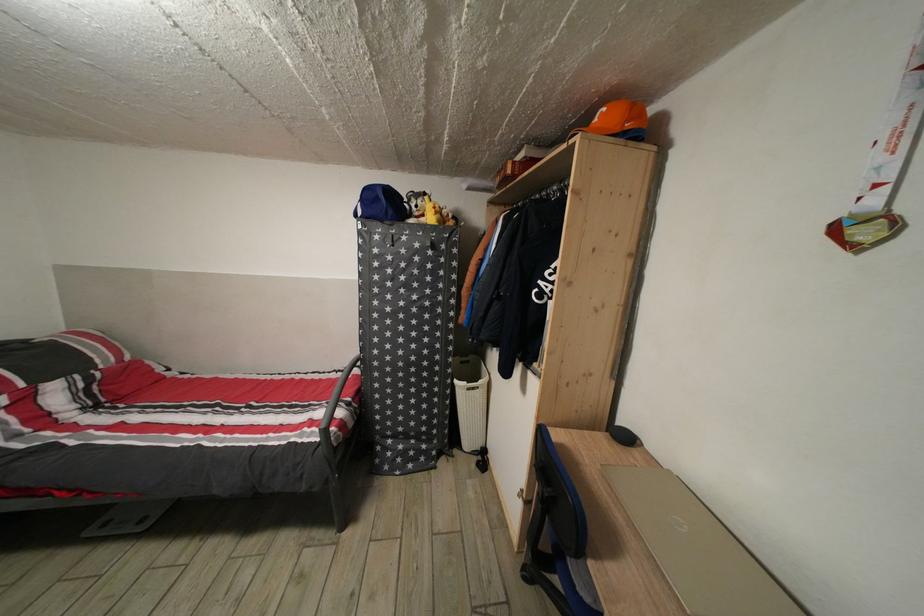
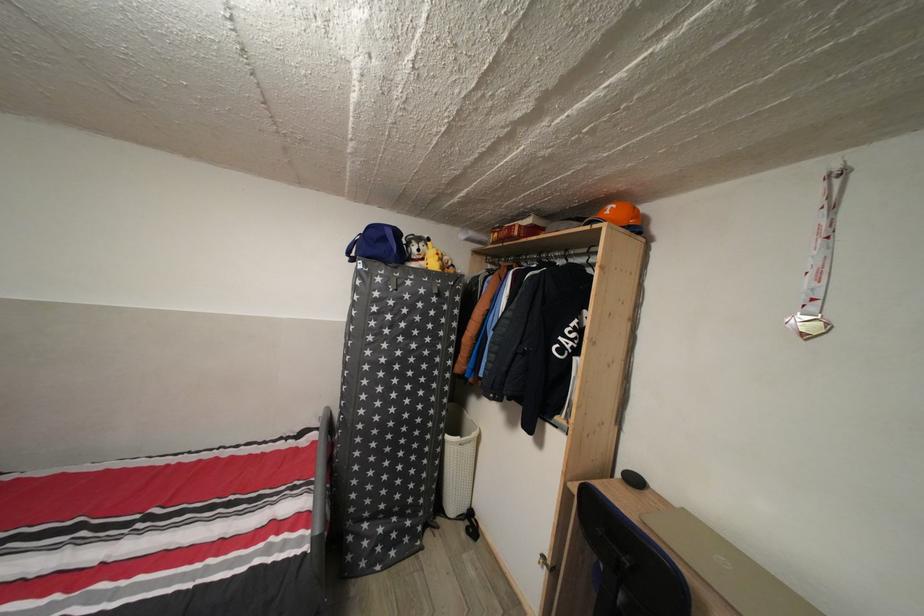
In the second image, find the point that corresponds to (x=463, y=387) in the first image.

(455, 444)